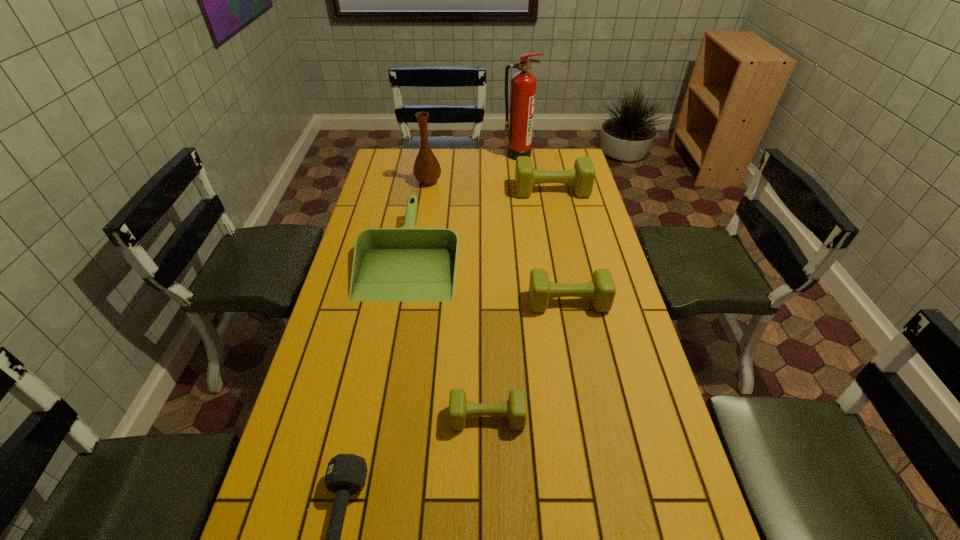
Locate which dumbbell ranks in proximity to the brown vase. Please provide its 2D coordinates. Your answer should be formatted as a tuple, i.e. [(x, y)], where the tuple contains the x and y coordinates of a point satisfying the conditions above.

[(582, 176)]

Identify which olive dumbbell is the third closest to the nearest dumbbell. Please provide its 2D coordinates. Your answer should be formatted as a tuple, i.e. [(x, y)], where the tuple contains the x and y coordinates of a point satisfying the conditions above.

[(582, 176)]

Image resolution: width=960 pixels, height=540 pixels. Find the location of `olive dumbbell identified as the closest to the biggest olive dumbbell`. olive dumbbell identified as the closest to the biggest olive dumbbell is located at coordinates click(x=601, y=290).

Locate an element on the screen. The height and width of the screenshot is (540, 960). vacant space that satisfies the following two spatial constraints: 1. on the back side of the smallest olive dumbbell; 2. on the left side of the second farthest olive dumbbell is located at coordinates (486, 302).

Locate an element on the screen. Image resolution: width=960 pixels, height=540 pixels. vacant position in the image that satisfies the following two spatial constraints: 1. on the scoop of the dustpan; 2. on the left side of the second farthest dumbbell is located at coordinates (401, 302).